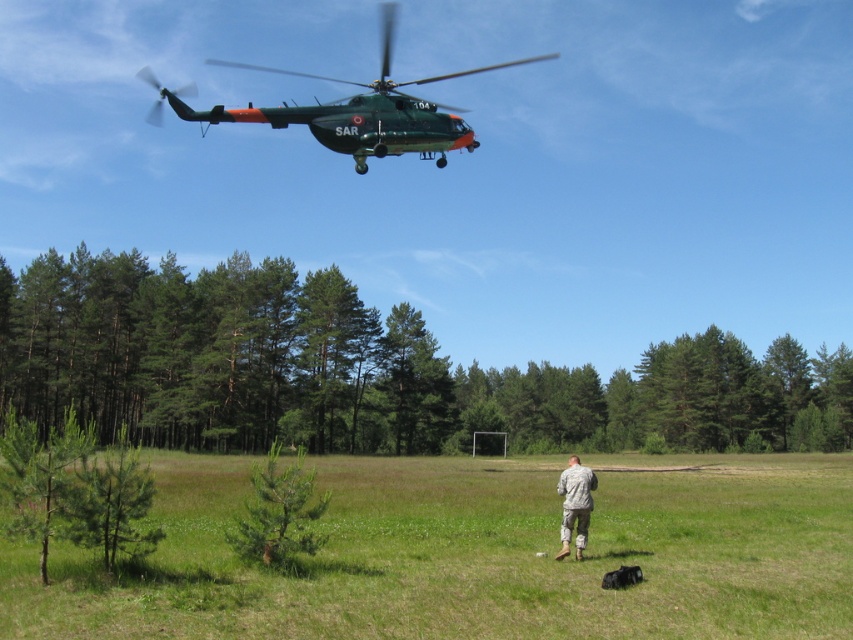
You are a photographer trying to capture a clear shot of the black fur dog at lower center. Since the green grass at center is blocking the view, can you move to the left or right to get a better angle? Explain why based on their sizes.

The green grass at center is bigger than the black fur dog at lower center, so moving to either the left or right might help you get a better angle by reducing the obstruction caused by the larger grass area.

You are a drone operator trying to locate the camouflage uniform at center in the image. The drone has a camera with a field of view that can only see objects within a 0.2 radius from the center point. If you set the target coordinates to point (575, 504), will the camouflage uniform at center be within the camera view?

The camouflage uniform at center is represented by point (575, 504). Since the target coordinates are set to exactly that point, the camouflage uniform at center will be within the camera view as it is at the center of the field of view.